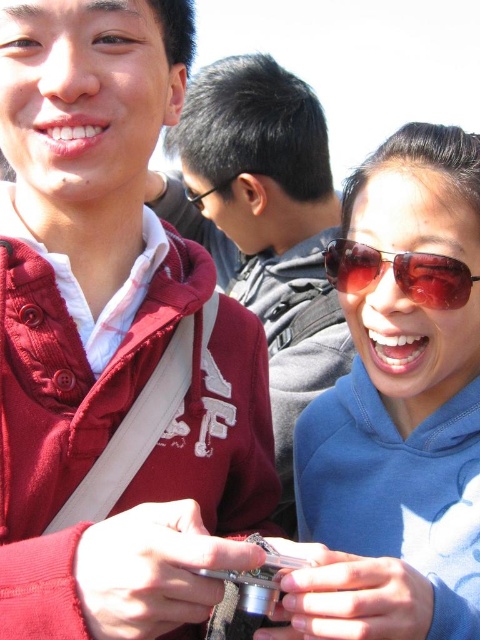
Consider the image. Who is more forward, (432, 177) or (420, 284)?

Point (420, 284)

Between point (338, 449) and point (354, 252), which one is positioned behind?

The point (338, 449) is more distant.

The width and height of the screenshot is (480, 640). I want to click on matte blue hoodie at center, so click(398, 406).

Between matte red jacket at left and matte blue hoodie at center, which one is positioned lower?

matte blue hoodie at center is below.

Between matte red jacket at left and matte blue hoodie at center, which one appears on the right side from the viewer's perspective?

Positioned to the right is matte blue hoodie at center.

What do you see at coordinates (112, 337) in the screenshot? I see `matte red jacket at left` at bounding box center [112, 337].

Image resolution: width=480 pixels, height=640 pixels. I want to click on matte red jacket at left, so click(112, 337).

Is matte red hoodie at center positioned behind shiny brown sunglasses at lower right?

That is True.

Is matte red hoodie at center taller than shiny brown sunglasses at lower right?

In fact, matte red hoodie at center may be shorter than shiny brown sunglasses at lower right.

The image size is (480, 640). Describe the element at coordinates (264, 225) in the screenshot. I see `matte red hoodie at center` at that location.

At what (x,y) coordinates should I click in order to perform the action: click on matte red hoodie at center. Please return your answer as a coordinate pair (x, y). Looking at the image, I should click on (264, 225).